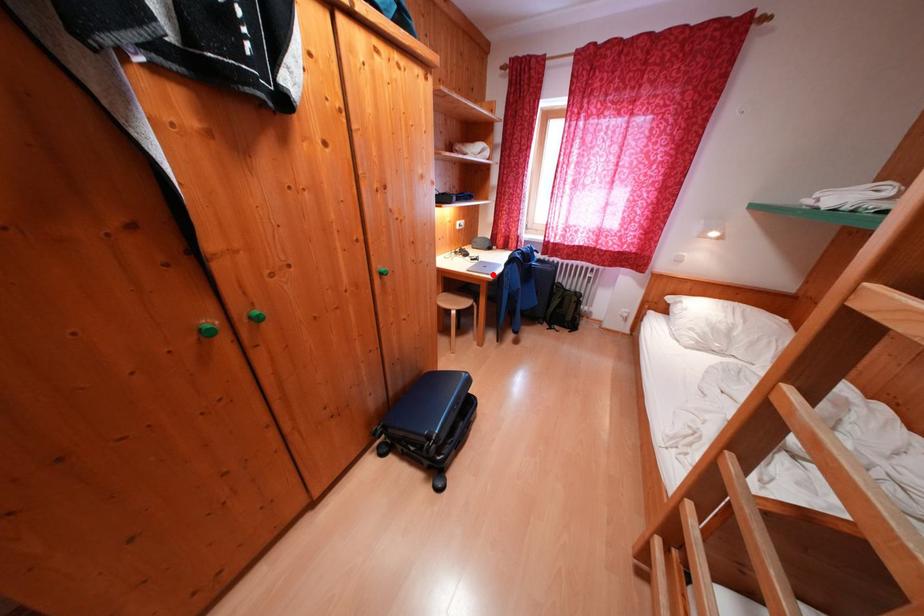
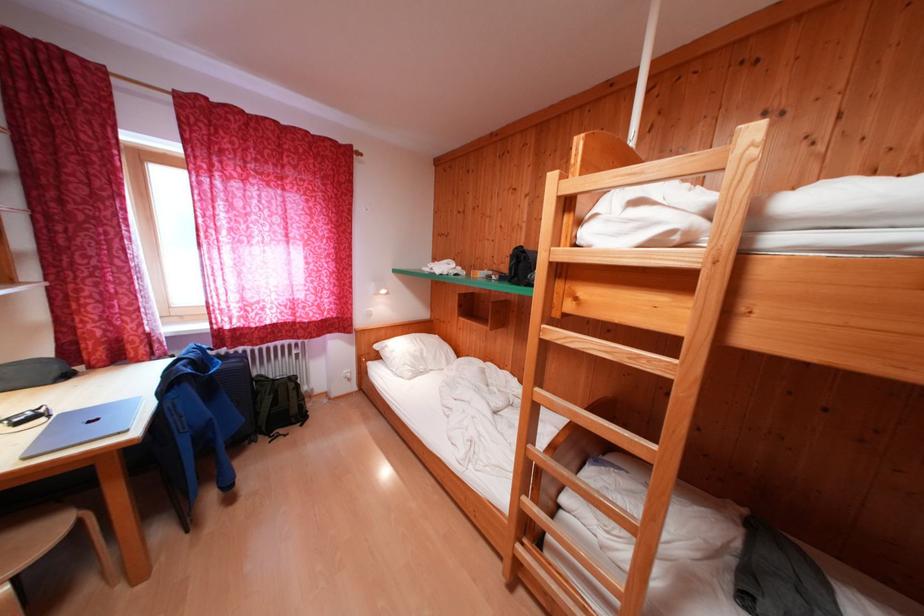
The point at the highlighted location is marked in the first image. Where is the corresponding point in the second image?

(104, 434)